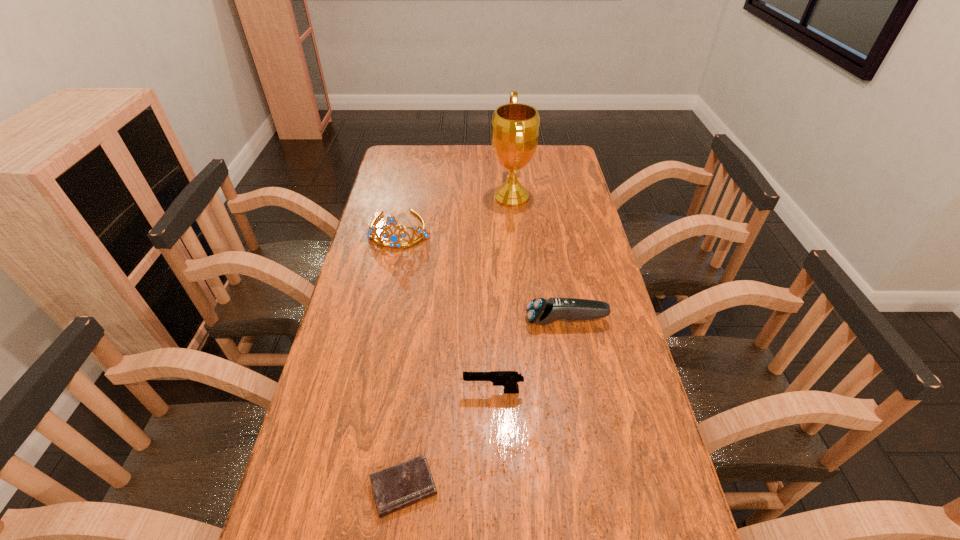
This screenshot has width=960, height=540. What are the coordinates of `free space between the shortest object and the pistol` in the screenshot? It's located at (448, 440).

This screenshot has width=960, height=540. I want to click on vacant space that is in between the fourth shortest object and the electric shaver, so click(x=483, y=275).

Find the location of a particular element. vacant area that lies between the shortest object and the fourth farthest object is located at coordinates (448, 440).

Identify the location of the second closest object to the fourth shortest object. The image size is (960, 540). (540, 311).

I want to click on object that stands as the second closest to the nearest object, so click(540, 311).

The height and width of the screenshot is (540, 960). I want to click on vacant space that satisfies the following two spatial constraints: 1. on the head of the third nearest object; 2. on the front side of the nearest object, so click(597, 488).

Find the location of a particular element. This screenshot has height=540, width=960. free location that satisfies the following two spatial constraints: 1. on the front-facing side of the tallest object; 2. on the front-facing side of the second tallest object is located at coordinates (515, 230).

This screenshot has width=960, height=540. In order to click on vacant space that satisfies the following two spatial constraints: 1. on the front-facing side of the shortest object; 2. on the left side of the fourth shortest object in this screenshot , I will do `click(346, 488)`.